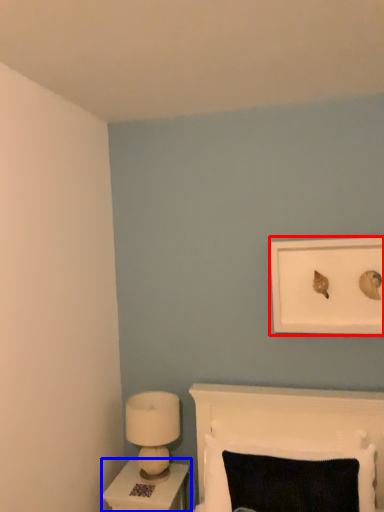
Question: Which of the following is the closest to the observer, picture frame (highlighted by a red box) or nightstand (highlighted by a blue box)?

Choices:
 (A) picture frame
 (B) nightstand

Answer: (A)